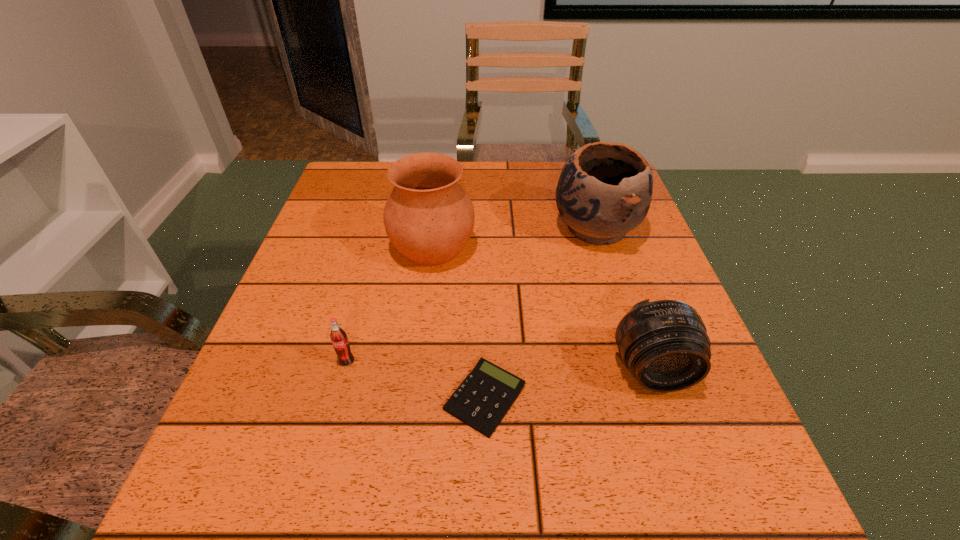
The width and height of the screenshot is (960, 540). I want to click on vacant space at the near right corner, so click(x=737, y=503).

Identify the location of vacant point located between the right pottery and the left pottery. (514, 239).

Locate an element on the screen. free space between the shortest object and the left pottery is located at coordinates (459, 322).

The width and height of the screenshot is (960, 540). Find the location of `vacant area between the right pottery and the left pottery`. vacant area between the right pottery and the left pottery is located at coordinates (514, 239).

The height and width of the screenshot is (540, 960). Identify the location of free space that is in between the calculator and the right pottery. (540, 314).

You are a GUI agent. You are given a task and a screenshot of the screen. Output one action in this format:
    pyautogui.click(x=<x>, y=<y>)
    Task: Click on the free spot between the right pottery and the shortest object
    This screenshot has width=960, height=540.
    Given the screenshot: What is the action you would take?
    pyautogui.click(x=540, y=314)

Image resolution: width=960 pixels, height=540 pixels. I want to click on free spot between the third tallest object and the soda bottle, so click(x=499, y=366).

The image size is (960, 540). What are the coordinates of `vacant space that is in between the right pottery and the leftmost object` in the screenshot? It's located at (471, 295).

I want to click on free space between the telephoto lens and the right pottery, so click(624, 300).

Image resolution: width=960 pixels, height=540 pixels. In order to click on free space that is in between the left pottery and the right pottery in this screenshot , I will do `click(514, 239)`.